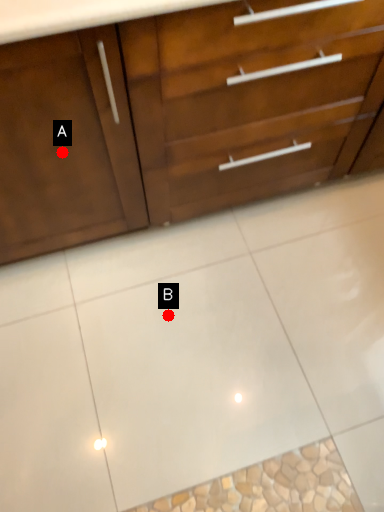
Question: Two points are circled on the image, labeled by A and B beside each circle. Which point is closer to the camera?

Choices:
 (A) A is closer
 (B) B is closer

Answer: (A)